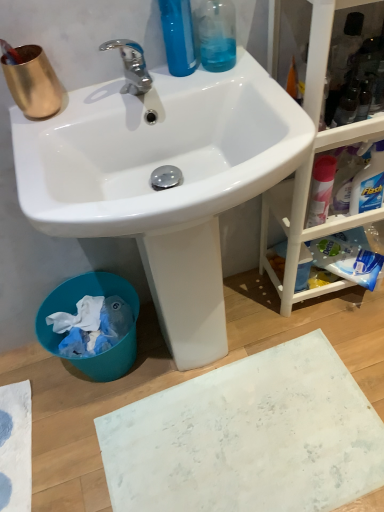
Locate an element on the screen. The image size is (384, 512). free spot in front of transparent plastic bottle at upper center is located at coordinates (237, 83).